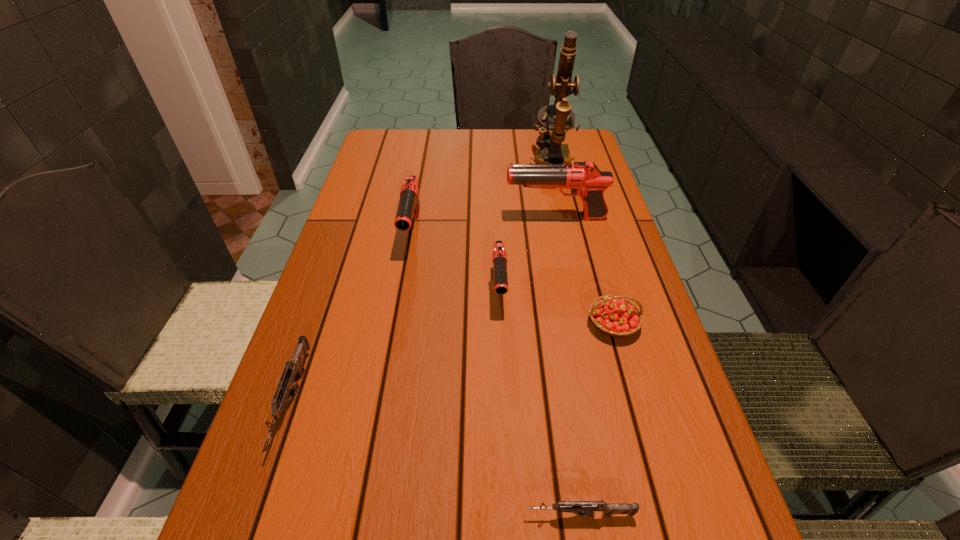
The height and width of the screenshot is (540, 960). What are the coordinates of `vacant area at the far edge of the desktop` in the screenshot? It's located at (492, 154).

Identify the location of free space at the left edge. [x=331, y=411].

Find the location of a particular element. free space at the right edge is located at coordinates (582, 215).

Find the location of a particular element. vacant space at the far left corner of the desktop is located at coordinates (397, 141).

The width and height of the screenshot is (960, 540). In order to click on vacant space at the far right corner in this screenshot , I will do `click(571, 129)`.

In order to click on vacant space that's between the farthest object and the strawberry in this screenshot , I will do `click(582, 244)`.

Identify the location of vacant space in between the nearest object and the tallest object. This screenshot has height=540, width=960. (565, 339).

Where is `empty location between the brown strawberry and the shortest object`? The image size is (960, 540). empty location between the brown strawberry and the shortest object is located at coordinates (596, 420).

The width and height of the screenshot is (960, 540). Find the location of `vacant region between the brown strawberry and the tallest object`. vacant region between the brown strawberry and the tallest object is located at coordinates (582, 244).

Locate an element on the screen. empty location between the biggest black gun and the second nearest gun is located at coordinates (424, 309).